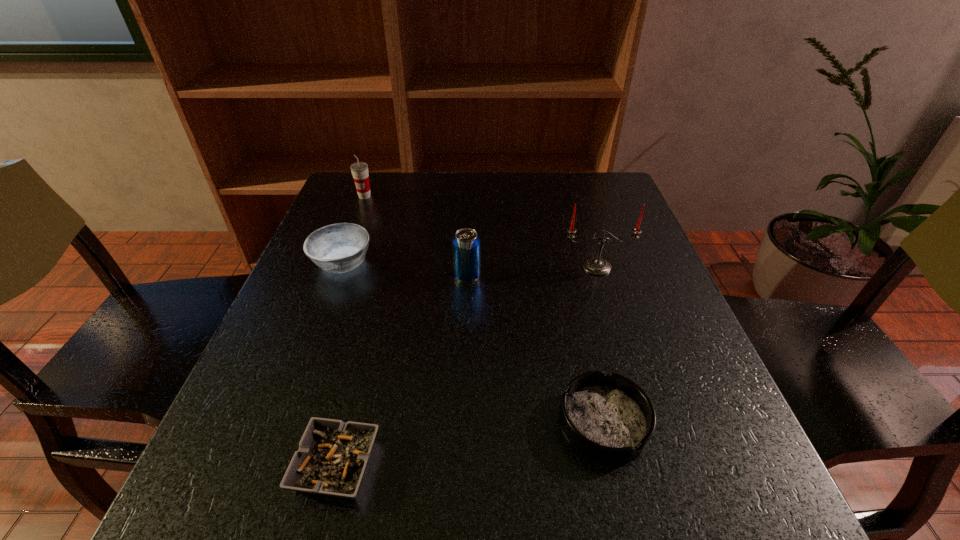
Locate an element on the screen. Image resolution: width=960 pixels, height=540 pixels. vacant space that satisfies the following two spatial constraints: 1. on the side of the farthest object with the logo; 2. on the right side of the farthest ashtray is located at coordinates (340, 263).

Identify the location of vacant point that satisfies the following two spatial constraints: 1. on the back side of the fourth object from left to right; 2. on the right side of the shortest object. The width and height of the screenshot is (960, 540). (384, 276).

Image resolution: width=960 pixels, height=540 pixels. What are the coordinates of `free spot that satisfies the following two spatial constraints: 1. on the side of the shortest ashtray with the logo; 2. on the right side of the farthest object` in the screenshot? It's located at (263, 465).

The height and width of the screenshot is (540, 960). Find the location of `free location that satisfies the following two spatial constraints: 1. on the side of the farthest object with the logo; 2. on the right side of the fifth tallest object`. free location that satisfies the following two spatial constraints: 1. on the side of the farthest object with the logo; 2. on the right side of the fifth tallest object is located at coordinates (279, 422).

At what (x,y) coordinates should I click in order to perform the action: click on vacant area in the image that satisfies the following two spatial constraints: 1. on the back side of the shortest ashtray; 2. on the left side of the second shortest object. Please return your answer as a coordinate pair (x, y). Looking at the image, I should click on (348, 422).